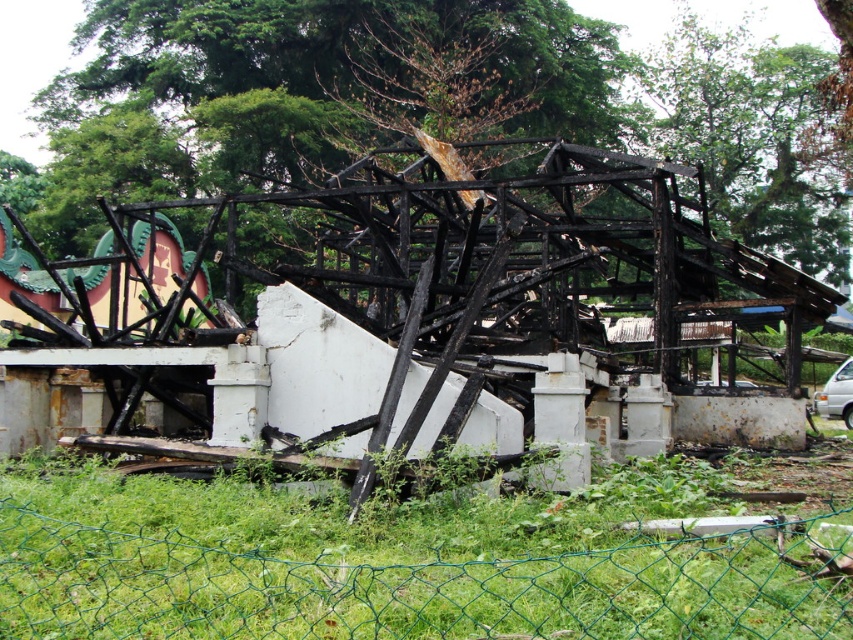
You are a surveyor assessing the damage to the ruins. You notice a brown wood tree at upper center in the scene. What is the exact coordinate of this tree?

The brown wood tree at upper center is located at point (x=184, y=104).

You are a construction worker assessing the site. You need to determine if the brown wood tree at upper center can be safely removed without damaging the green wire mesh fence at lower center. Based on their sizes, what should you consider?

The brown wood tree at upper center is wider than the green wire mesh fence at lower center, so you should take care to ensure that removing the tree does not encroach on the fence area due to its larger size.

You are a firefighter assessing the scene. You notice the brown wood tree at upper center and the green wire mesh fence at lower center. Which object is positioned higher in the image?

The brown wood tree at upper center is positioned higher than the green wire mesh fence at lower center.